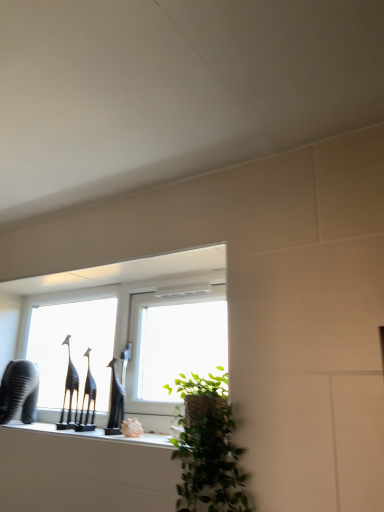
The height and width of the screenshot is (512, 384). What do you see at coordinates (126, 329) in the screenshot? I see `transparent glass window at center` at bounding box center [126, 329].

This screenshot has width=384, height=512. I want to click on transparent glass window at center, so click(x=126, y=329).

Where is `transparent glass window at center`? transparent glass window at center is located at coordinates (126, 329).